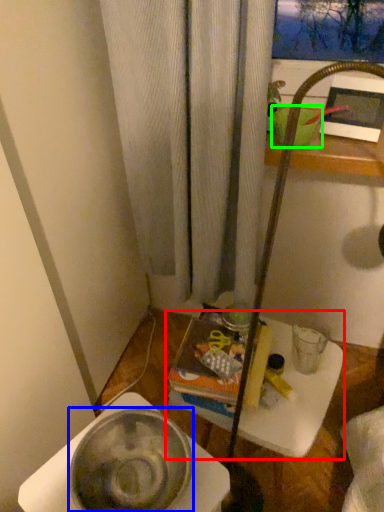
Question: Based on their relative distances, which object is farther from table (highlighted by a red box)? Choose from basin (highlighted by a blue box) and basin (highlighted by a green box).

Choices:
 (A) basin
 (B) basin

Answer: (B)